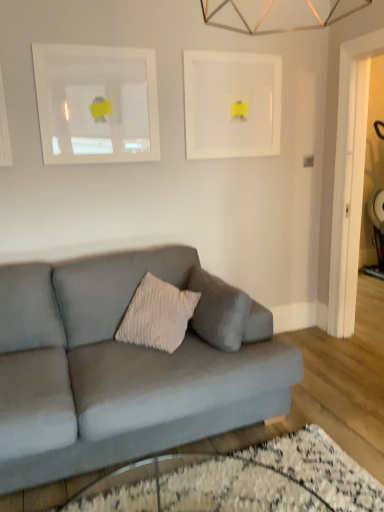
Question: Is transparent glass table at lower center positioned with its back to matte gray couch at center?

Choices:
 (A) yes
 (B) no

Answer: (B)

Question: From a real-world perspective, is transparent glass table at lower center below matte gray couch at center?

Choices:
 (A) yes
 (B) no

Answer: (A)

Question: Does transparent glass table at lower center lie in front of matte gray couch at center?

Choices:
 (A) yes
 (B) no

Answer: (A)

Question: Considering the relative sizes of transparent glass table at lower center and matte gray couch at center in the image provided, is transparent glass table at lower center wider than matte gray couch at center?

Choices:
 (A) yes
 (B) no

Answer: (A)

Question: From the image's perspective, is transparent glass table at lower center beneath matte gray couch at center?

Choices:
 (A) no
 (B) yes

Answer: (B)

Question: Looking at their shapes, would you say white matte picture frame at upper center, the 1th picture frame viewed from the right, is wider or thinner than matte gray couch at center?

Choices:
 (A) thin
 (B) wide

Answer: (A)

Question: Considering the positions of white matte picture frame at upper center, the 1th picture frame viewed from the right, and matte gray couch at center in the image, is white matte picture frame at upper center, the 1th picture frame viewed from the right, bigger or smaller than matte gray couch at center?

Choices:
 (A) big
 (B) small

Answer: (B)

Question: From the image's perspective, is white matte picture frame at upper center, the 1th picture frame viewed from the right, above or below matte gray couch at center?

Choices:
 (A) above
 (B) below

Answer: (A)

Question: Considering their positions, is white matte picture frame at upper center, which is the second picture frame from left to right, located in front of or behind matte gray couch at center?

Choices:
 (A) behind
 (B) front

Answer: (A)

Question: Based on their positions, is transparent glass table at lower center located to the left or right of matte gray couch at center?

Choices:
 (A) right
 (B) left

Answer: (A)

Question: Is transparent glass table at lower center inside the boundaries of matte gray couch at center, or outside?

Choices:
 (A) outside
 (B) inside

Answer: (A)

Question: Looking at their shapes, would you say transparent glass table at lower center is wider or thinner than matte gray couch at center?

Choices:
 (A) thin
 (B) wide

Answer: (B)

Question: Based on their sizes in the image, would you say transparent glass table at lower center is bigger or smaller than matte gray couch at center?

Choices:
 (A) small
 (B) big

Answer: (A)

Question: Looking at the image, does white matte picture frame at upper left, which ranks as the first picture frame in left-to-right order, seem bigger or smaller compared to white matte picture frame at upper center, which is the second picture frame from left to right?

Choices:
 (A) big
 (B) small

Answer: (A)

Question: Considering the positions of white matte picture frame at upper left, which is the second picture frame from right to left, and white matte picture frame at upper center, which is the second picture frame from left to right, in the image, is white matte picture frame at upper left, which is the second picture frame from right to left, taller or shorter than white matte picture frame at upper center, which is the second picture frame from left to right,?

Choices:
 (A) short
 (B) tall

Answer: (A)